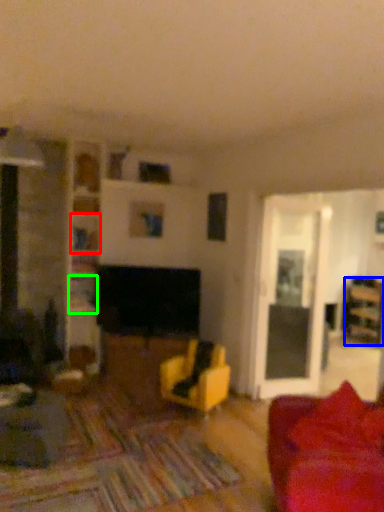
Question: Which object is the closest to the shelf (highlighted by a red box)? Choose among these: furniture (highlighted by a blue box) or shelf (highlighted by a green box).

Choices:
 (A) furniture
 (B) shelf

Answer: (B)